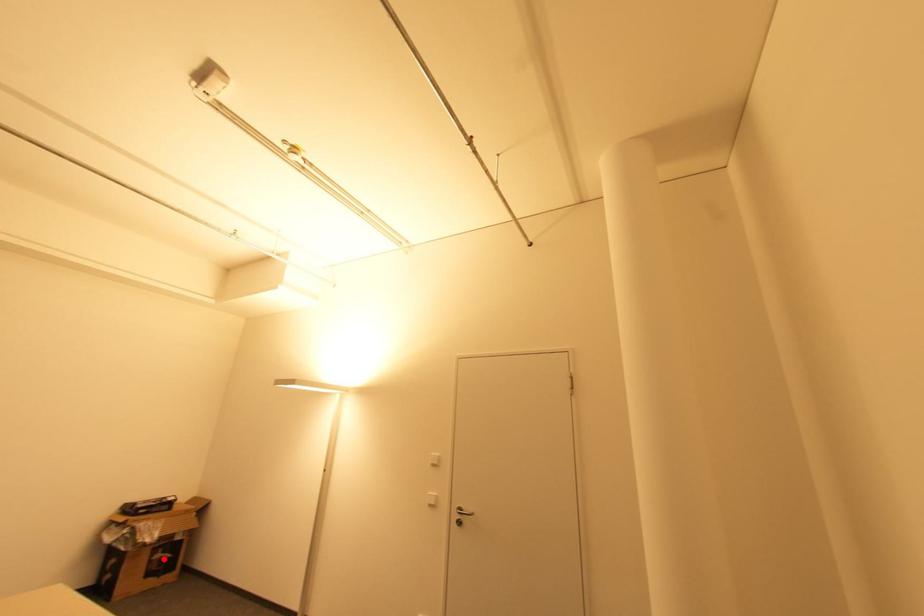
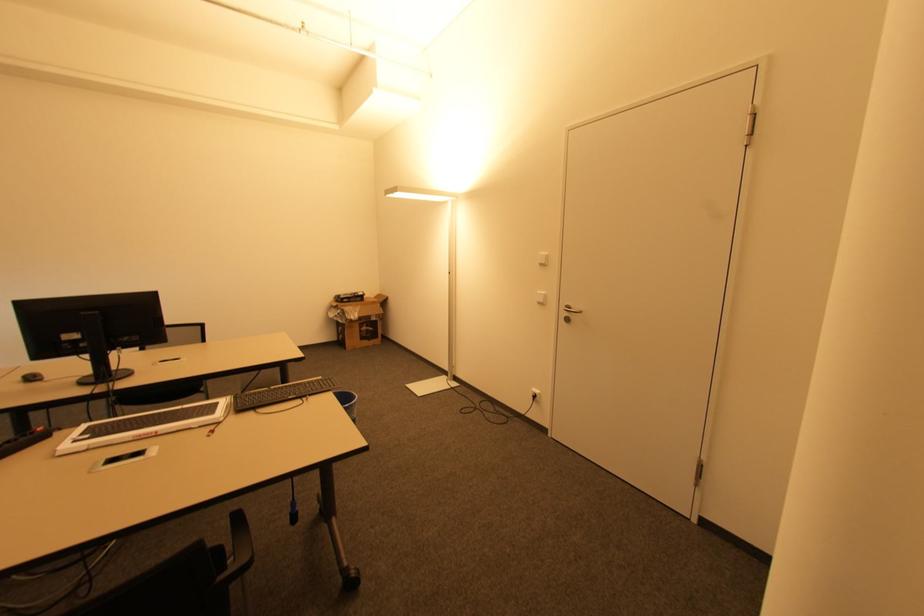
Locate, in the second image, the point that corresponds to the highlighted location in the first image.

(369, 331)